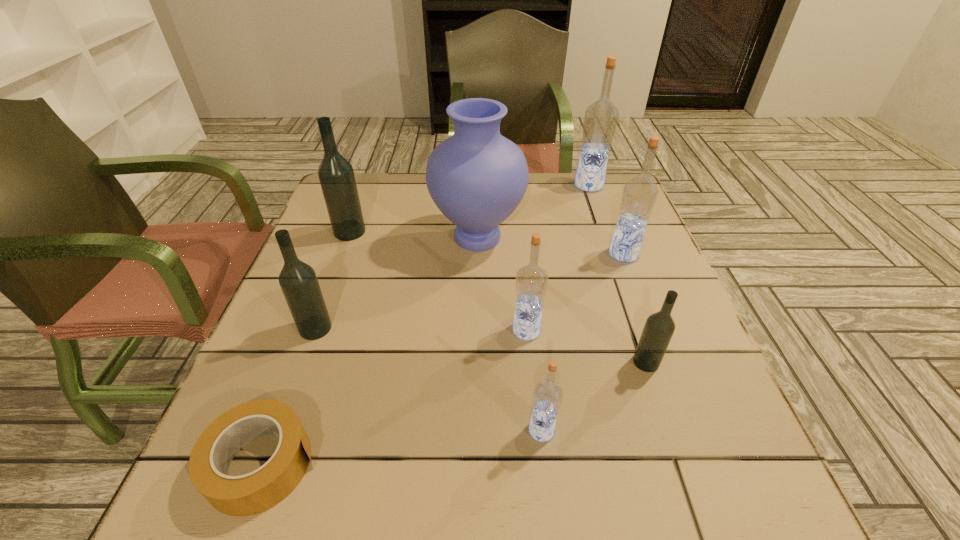
Find the location of `the third nearest object`. the third nearest object is located at coordinates (658, 330).

Locate an element on the screen. the nearest vodka is located at coordinates (547, 397).

Where is `the nearest blue vodka`? the nearest blue vodka is located at coordinates (547, 397).

Identify the location of duct tape. Image resolution: width=960 pixels, height=540 pixels. (255, 492).

Find the location of `free space located on the front of the farthest vodka`. free space located on the front of the farthest vodka is located at coordinates (595, 205).

Locate an element on the screen. vacant region located 0.170m on the front of the vase is located at coordinates (477, 321).

Locate an element on the screen. The height and width of the screenshot is (540, 960). free spot located on the back of the farthest black vodka is located at coordinates (370, 179).

Image resolution: width=960 pixels, height=540 pixels. I want to click on vacant space located on the left of the second biggest blue vodka, so click(x=575, y=254).

Image resolution: width=960 pixels, height=540 pixels. What are the coordinates of `free space located on the back of the second smallest black vodka` in the screenshot? It's located at [x=337, y=269].

Locate an element on the screen. free space located 0.090m on the front of the second nearest blue vodka is located at coordinates (532, 380).